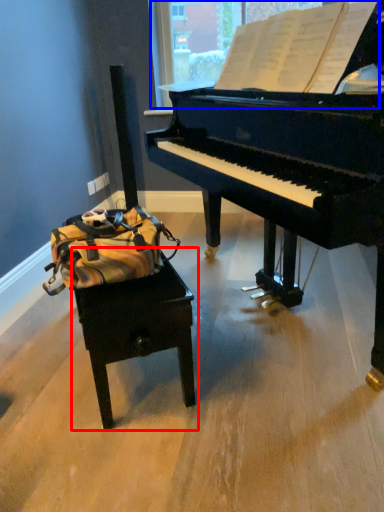
Question: Which object is further to the camera taking this photo, table (highlighted by a red box) or window screen (highlighted by a blue box)?

Choices:
 (A) table
 (B) window screen

Answer: (A)